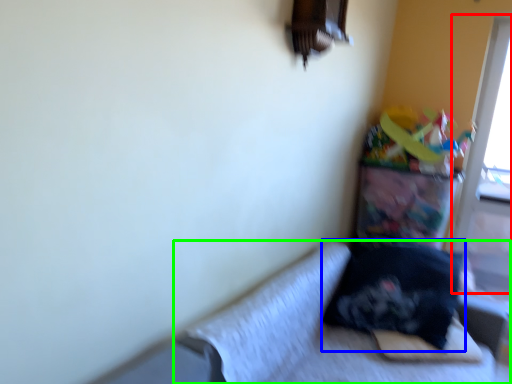
Question: Which object is positioned closest to screen door (highlighted by a red box)? Select from pillow (highlighted by a blue box) and studio couch (highlighted by a green box).

Choices:
 (A) pillow
 (B) studio couch

Answer: (A)